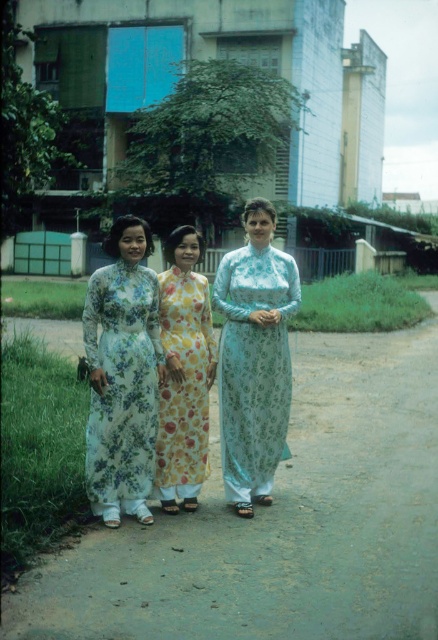
Is smooth concrete path at center below yellow floral silk dress at center?

Yes, smooth concrete path at center is below yellow floral silk dress at center.

Which is below, smooth concrete path at center or yellow floral silk dress at center?

smooth concrete path at center is below.

Describe the element at coordinates (281, 522) in the screenshot. This screenshot has height=640, width=438. I see `smooth concrete path at center` at that location.

Locate an element on the screen. The image size is (438, 640). smooth concrete path at center is located at coordinates (281, 522).

Is the position of smooth concrete path at center less distant than that of light blue floral ao dai at center?

Yes, it is in front of light blue floral ao dai at center.

Measure the distance between smooth concrete path at center and camera.

They are 3.92 meters apart.

You are a GUI agent. You are given a task and a screenshot of the screen. Output one action in this format:
    pyautogui.click(x=<x>, y=<y>)
    Task: Click on the smooth concrete path at center
    This screenshot has width=438, height=640.
    Given the screenshot: What is the action you would take?
    pyautogui.click(x=281, y=522)

What do you see at coordinates (122, 385) in the screenshot? I see `floral silk ao dai at center` at bounding box center [122, 385].

Consider the image. Is floral silk ao dai at center to the right of yellow floral silk dress at center from the viewer's perspective?

Incorrect, floral silk ao dai at center is not on the right side of yellow floral silk dress at center.

Locate an element on the screen. The width and height of the screenshot is (438, 640). floral silk ao dai at center is located at coordinates (122, 385).